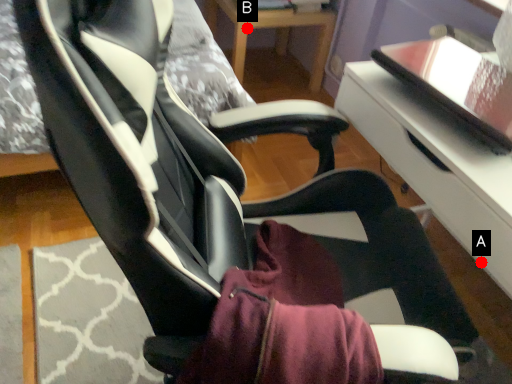
Question: Two points are circled on the image, labeled by A and B beside each circle. Which point is closer to the camera?

Choices:
 (A) A is closer
 (B) B is closer

Answer: (A)